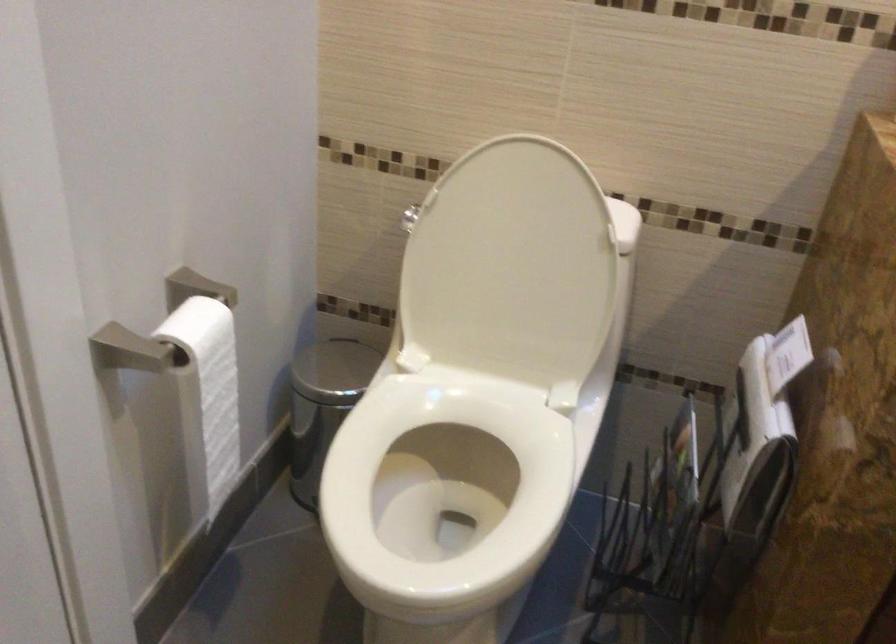
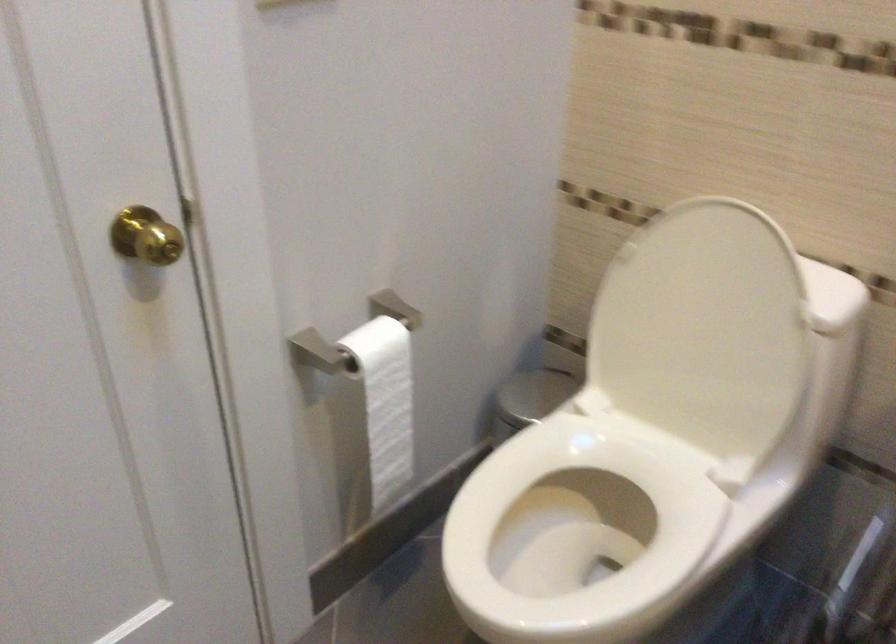
Where in the second image is the point corresponding to point 515,267 from the first image?

(702, 330)